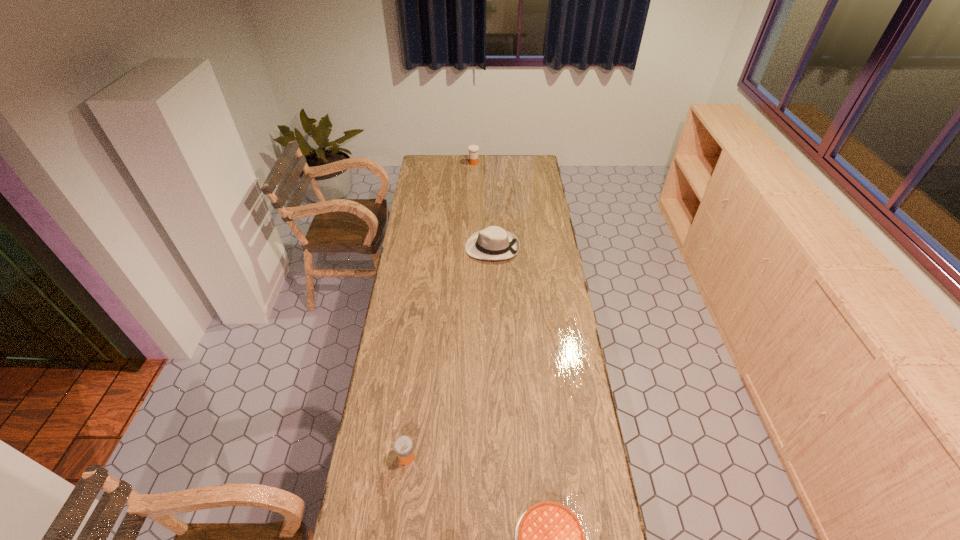
Find the location of a particular element. Image resolution: width=960 pixels, height=540 pixels. object present at the far edge is located at coordinates (473, 149).

The width and height of the screenshot is (960, 540). I want to click on object present at the left edge, so click(403, 445).

Identify the location of vacant region at the far edge of the desktop. (455, 155).

Locate an element on the screen. Image resolution: width=960 pixels, height=540 pixels. vacant space at the left edge of the desktop is located at coordinates (395, 402).

At what (x,y) coordinates should I click in order to perform the action: click on blank space at the right edge of the desktop. Please return your answer as a coordinate pair (x, y). Looking at the image, I should click on (550, 262).

In the image, there is a desktop. Where is `vacant space at the far left corner`? vacant space at the far left corner is located at coordinates (425, 157).

You are a GUI agent. You are given a task and a screenshot of the screen. Output one action in this format:
    pyautogui.click(x=<x>, y=<y>)
    Task: Click on the unoccupied position between the fedora and the nearer medicine
    
    Given the screenshot: What is the action you would take?
    pyautogui.click(x=449, y=352)

Identify the location of free spot between the right medicine and the fedora. This screenshot has height=540, width=960. (483, 205).

The width and height of the screenshot is (960, 540). I want to click on free space between the fedora and the shorter medicine, so click(x=449, y=352).

Locate an element on the screen. The width and height of the screenshot is (960, 540). free space between the leftmost object and the second farthest object is located at coordinates (449, 352).